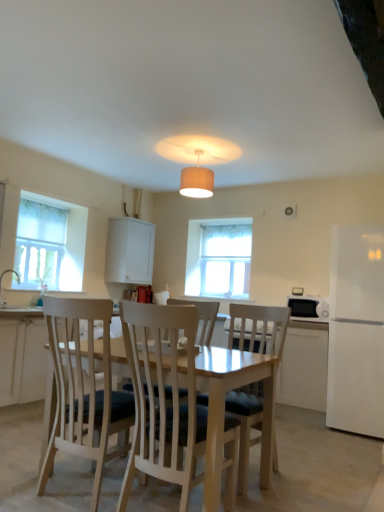
Question: In terms of width, does white matte cabinet at upper center look wider or thinner when compared to light wood chair at center, which is the first chair from right to left?

Choices:
 (A) thin
 (B) wide

Answer: (A)

Question: In terms of size, does white matte cabinet at upper center appear bigger or smaller than light wood chair at center, which is the first chair from right to left?

Choices:
 (A) big
 (B) small

Answer: (B)

Question: Based on their relative distances, which object is nearer to the white wood chair at center, which is the second chair from right to left?

Choices:
 (A) white matte dishwasher at lower right
 (B) white matte refrigerator at right
 (C) white matte cabinet at upper center
 (D) light wood chair at center, arranged as the 2th chair when viewed from the left
 (E) translucent fabric window at left, positioned as the second window in right-to-left order

Answer: (D)

Question: Which object is positioned closest to the light wood chair at center, which is the first chair from right to left?

Choices:
 (A) white matte cabinet at upper center
 (B) white glossy microwave at lower right
 (C) white wood chair at center, the first chair in the left-to-right sequence
 (D) white matte refrigerator at right
 (E) white fabric lampshade at center

Answer: (C)